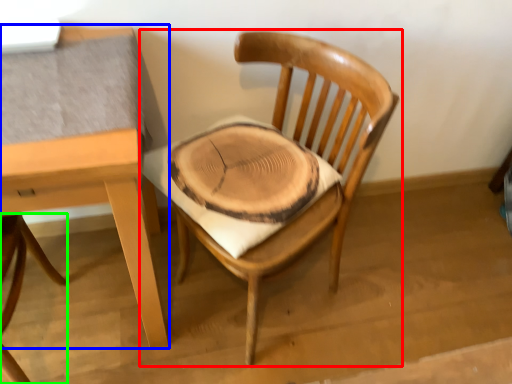
Question: Which is farther away from chair (highlighted by a red box)? table (highlighted by a blue box) or chair (highlighted by a green box)?

Choices:
 (A) table
 (B) chair

Answer: (B)